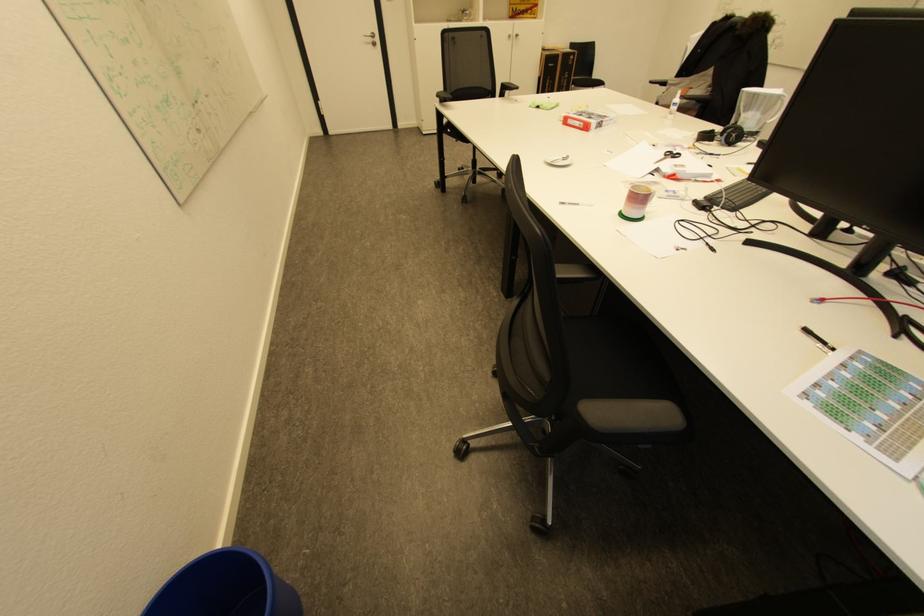
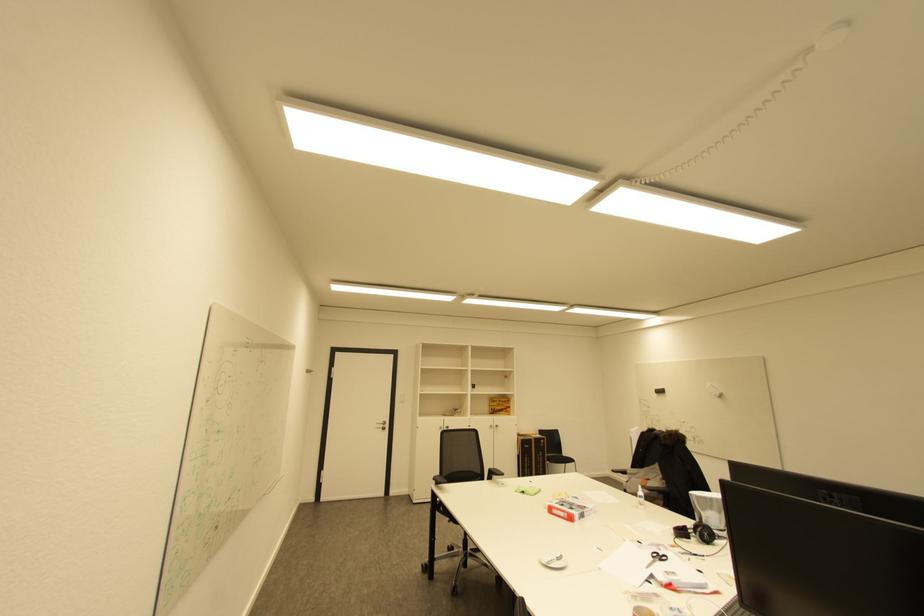
Find the pixel in the second image that matches point (570, 54) in the first image.

(541, 439)